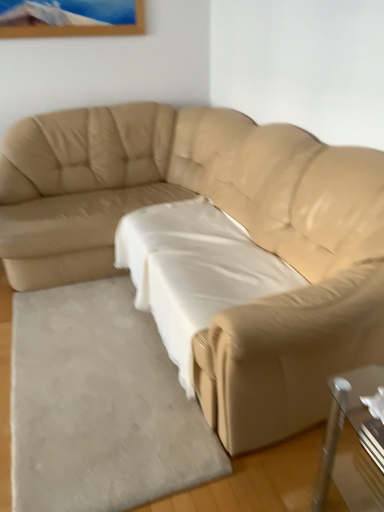
Question: Do you think white soft rug at lower left is within white fabric sheet at center, or outside of it?

Choices:
 (A) outside
 (B) inside

Answer: (A)

Question: In terms of width, does white soft rug at lower left look wider or thinner when compared to white fabric sheet at center?

Choices:
 (A) wide
 (B) thin

Answer: (A)

Question: Which is nearer to the white soft rug at lower left?

Choices:
 (A) beige leather couch at center
 (B) white fabric sheet at center

Answer: (B)

Question: Which object is the closest to the white soft rug at lower left?

Choices:
 (A) beige leather couch at center
 (B) white fabric sheet at center

Answer: (B)